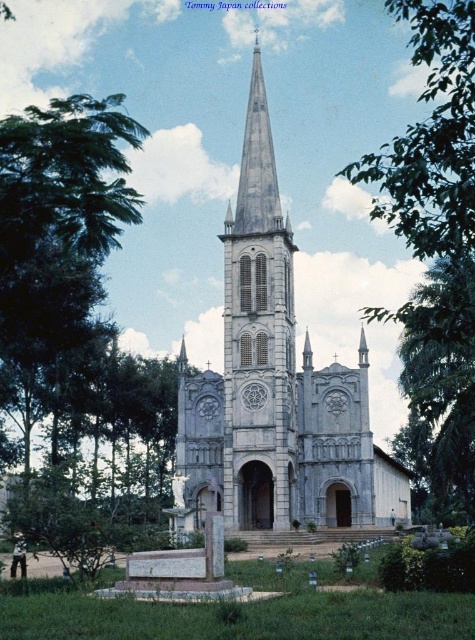
Can you confirm if white stone church at center is thinner than white stone tower at center?

Incorrect, white stone church at center's width is not less than white stone tower at center's.

Does white stone church at center have a lesser height compared to white stone tower at center?

Incorrect, white stone church at center's height does not fall short of white stone tower at center's.

Does point (290, 339) come closer to viewer compared to point (233, 472)?

No, (290, 339) is behind (233, 472).

Locate an element on the screen. white stone church at center is located at coordinates (275, 388).

Which is behind, point (247, 508) or point (443, 500)?

The point (443, 500) is behind.

Is white stone church at center taller than green leafy tree at right?

Correct, white stone church at center is much taller as green leafy tree at right.

Does point (269, 317) come behind point (456, 285)?

Yes.

Where is `white stone church at center`? The width and height of the screenshot is (475, 640). white stone church at center is located at coordinates (275, 388).

Does white stone tower at center have a lesser width compared to green leafy tree at upper right?

Yes, white stone tower at center is thinner than green leafy tree at upper right.

The image size is (475, 640). Describe the element at coordinates (258, 337) in the screenshot. I see `white stone tower at center` at that location.

Who is more forward, (230, 301) or (429, 81)?

Point (429, 81) is more forward.

This screenshot has width=475, height=640. In order to click on white stone tower at center in this screenshot , I will do `click(258, 337)`.